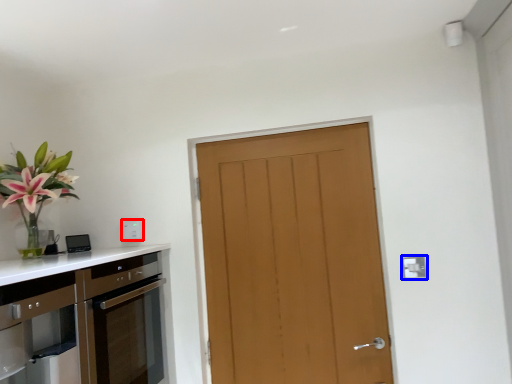
Question: Which object is closer to the camera taking this photo, electric outlet (highlighted by a red box) or electric outlet (highlighted by a blue box)?

Choices:
 (A) electric outlet
 (B) electric outlet

Answer: (B)